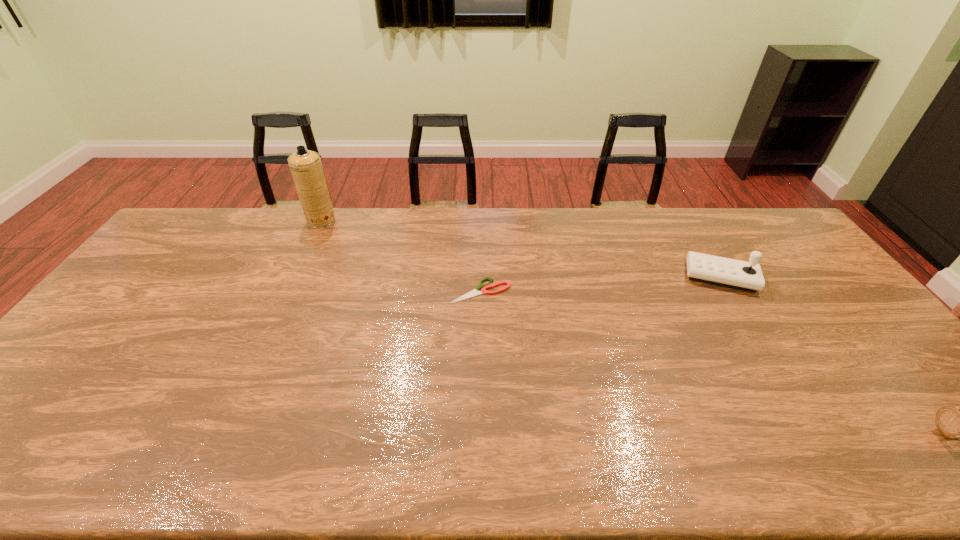
Image resolution: width=960 pixels, height=540 pixels. I want to click on the tallest object, so click(306, 168).

Image resolution: width=960 pixels, height=540 pixels. What are the coordinates of `the farthest object` in the screenshot? It's located at (306, 168).

The width and height of the screenshot is (960, 540). I want to click on joystick, so click(x=742, y=275).

Identify the location of the shortest object. The height and width of the screenshot is (540, 960). (490, 285).

Where is `the third object from right to left`? This screenshot has width=960, height=540. the third object from right to left is located at coordinates (490, 285).

Image resolution: width=960 pixels, height=540 pixels. Find the location of `vacant space located 0.060m on the left of the aerosol can`. vacant space located 0.060m on the left of the aerosol can is located at coordinates (291, 220).

Locate an element on the screen. free location located on the right of the third object from left to right is located at coordinates (786, 276).

This screenshot has height=540, width=960. I want to click on blank area located on the right of the scissors, so [614, 291].

The height and width of the screenshot is (540, 960). What are the coordinates of `object that is at the far edge` in the screenshot? It's located at (306, 168).

At what (x,y) coordinates should I click in order to perform the action: click on vacant space at the far edge. Please return your answer as a coordinate pair (x, y). This screenshot has width=960, height=540. Looking at the image, I should click on (384, 235).